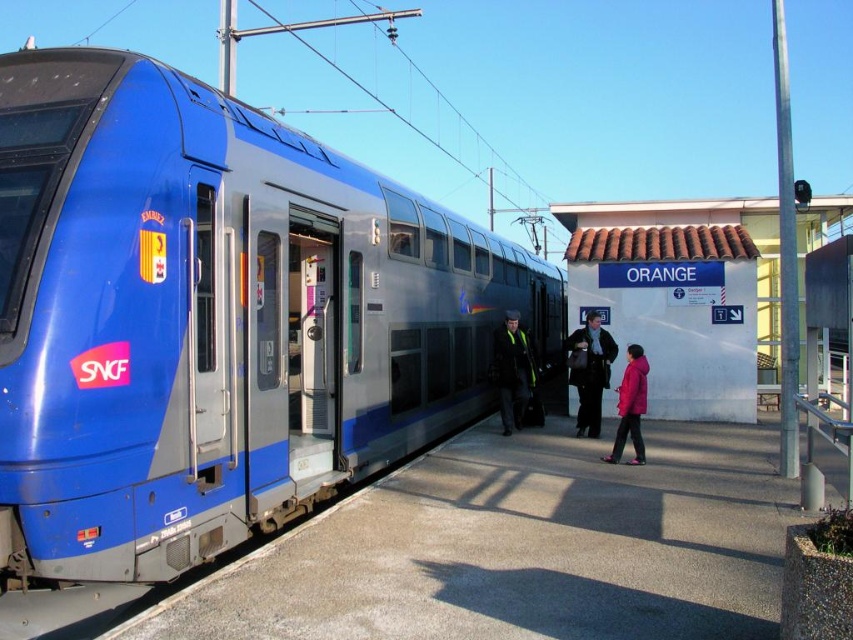
Describe the element at coordinates (512, 371) in the screenshot. I see `reflective yellow vest at center` at that location.

Is reflective yellow vest at center positioned at the back of pink matte jacket at center?

Yes, reflective yellow vest at center is behind pink matte jacket at center.

Is point (502, 403) positioned behind point (643, 412)?

Yes, point (502, 403) is farther from viewer.

Locate an element on the screen. The width and height of the screenshot is (853, 640). reflective yellow vest at center is located at coordinates (512, 371).

The height and width of the screenshot is (640, 853). What do you see at coordinates (213, 317) in the screenshot?
I see `matte blue train at left` at bounding box center [213, 317].

Is matte blue train at left below pink matte jacket at center?

Incorrect, matte blue train at left is not positioned below pink matte jacket at center.

Between point (260, 161) and point (624, 380), which one is positioned behind?

The point (624, 380) is more distant.

Locate an element on the screen. The height and width of the screenshot is (640, 853). matte blue train at left is located at coordinates (213, 317).

Can you confirm if matte blue train at left is bigger than reflective yellow vest at center?

Yes, matte blue train at left is bigger than reflective yellow vest at center.

Identify the location of matte blue train at left. (213, 317).